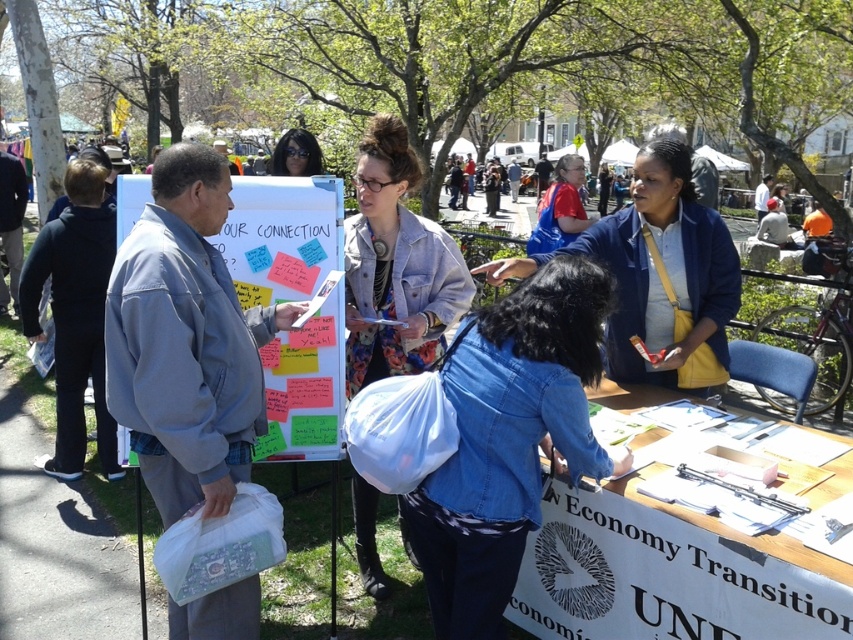
You are attending the Economy Transition event and want to approach both the denim jacket at left and the denim jacket at lower right to collect materials. Which denim jacket should you approach first to reach the closer one?

You should approach the denim jacket at left first because it is closer to you than the denim jacket at lower right, which is further away.

You are standing at the center of the park and see the point marked at coordinates (186, 340). What object is located at that point?

The point at (186, 340) marks the location of the denim jacket at left.